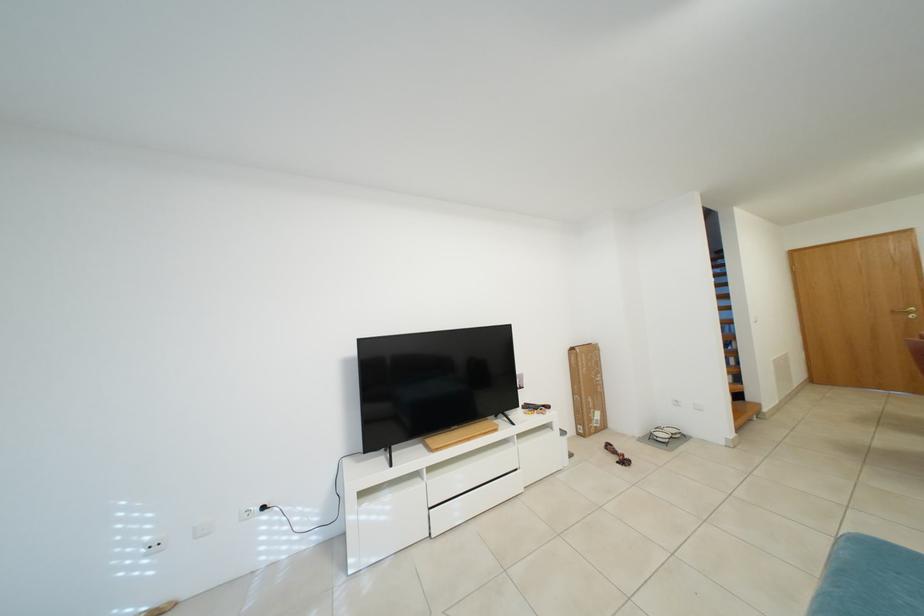
The image size is (924, 616). What do you see at coordinates (482, 495) in the screenshot? I see `a white drawer handle` at bounding box center [482, 495].